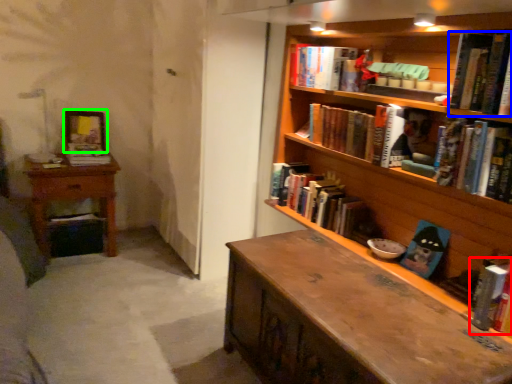
Question: Considering the real-world distances, which object is farthest from book (highlighted by a red box)? book (highlighted by a blue box) or picture frame (highlighted by a green box)?

Choices:
 (A) book
 (B) picture frame

Answer: (B)